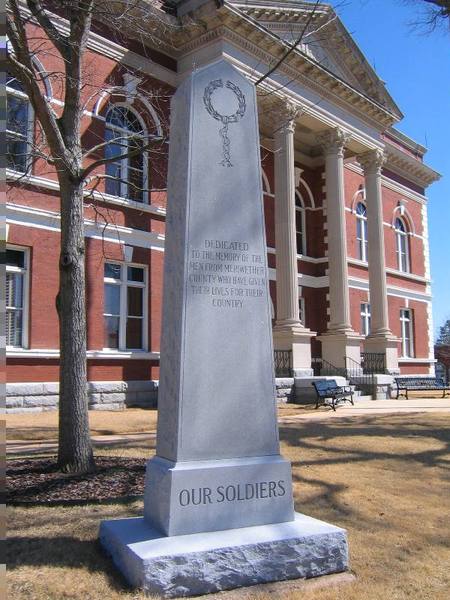
Locate an element on the screen. The image size is (450, 600). bench is located at coordinates (422, 381), (324, 386).